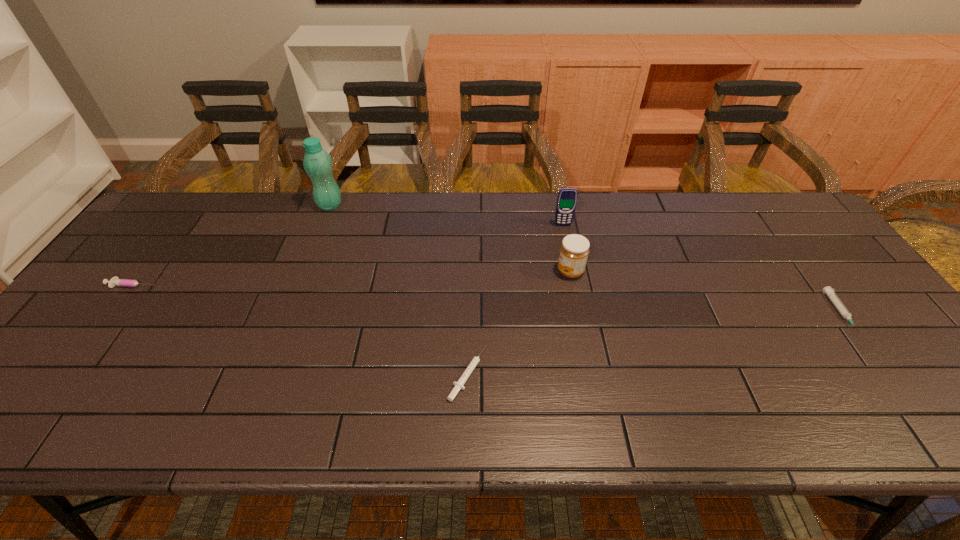
This screenshot has height=540, width=960. I want to click on cellular telephone that is at the far edge, so click(567, 197).

The image size is (960, 540). I want to click on object that is positioned at the near edge, so click(x=459, y=384).

I want to click on object located at the left edge, so click(115, 281).

Where is `object located in the right edge section of the desktop`? Image resolution: width=960 pixels, height=540 pixels. object located in the right edge section of the desktop is located at coordinates (829, 291).

Find the location of a particular element. This screenshot has width=960, height=540. free region at the far edge is located at coordinates (554, 214).

The width and height of the screenshot is (960, 540). I want to click on free location at the near edge, so click(x=418, y=410).

Image resolution: width=960 pixels, height=540 pixels. I want to click on free space at the left edge, so click(55, 362).

Locate an element on the screen. This screenshot has width=960, height=540. vacant space at the right edge is located at coordinates (895, 381).

Image resolution: width=960 pixels, height=540 pixels. In the image, there is a desktop. Identify the location of vacant region at the far left corner. (197, 205).

Locate an element on the screen. The width and height of the screenshot is (960, 540). vacant region between the fifth nearest object and the leftmost object is located at coordinates (348, 255).